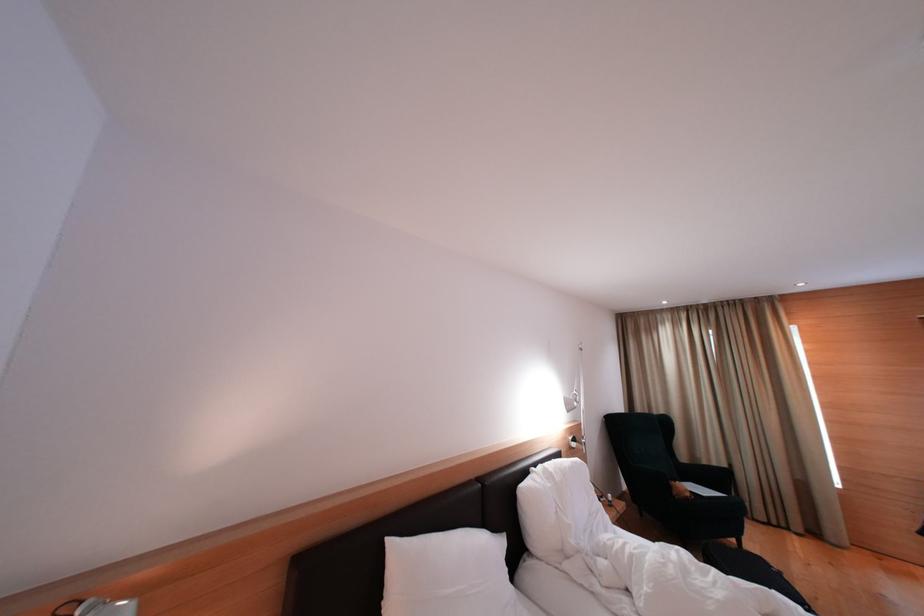
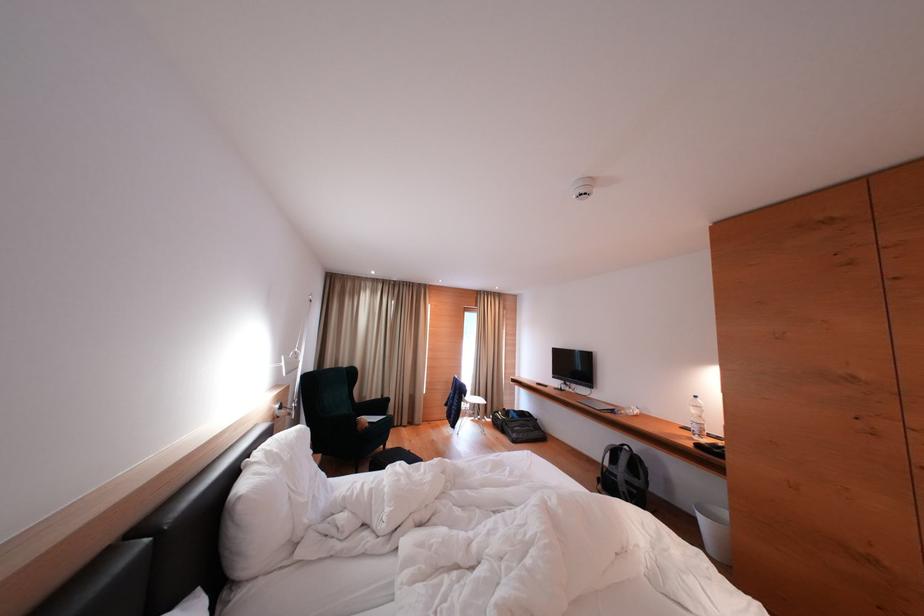
In the second image, find the point that corresponds to point 676,492 in the first image.

(362, 428)